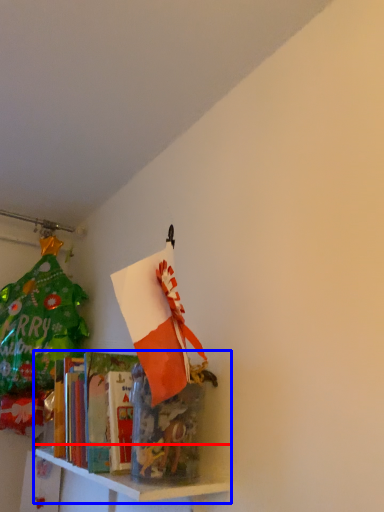
Question: Among these objects, which one is nearest to the camera, shelf (highlighted by a red box) or shelf (highlighted by a blue box)?

Choices:
 (A) shelf
 (B) shelf

Answer: (A)